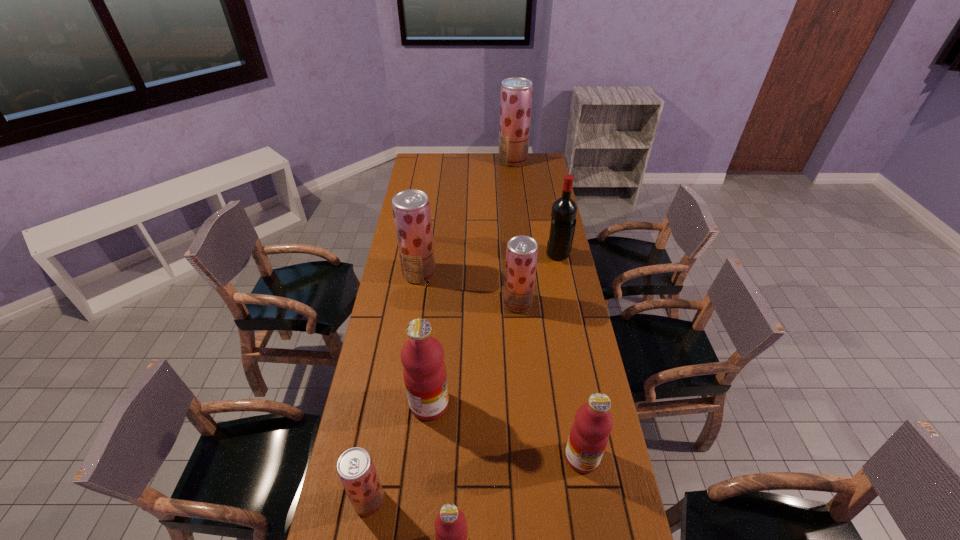
This screenshot has height=540, width=960. Identify the location of the farthest object. (516, 92).

Where is `the tallest fruit juice`? the tallest fruit juice is located at coordinates (516, 92).

In order to click on wine bottle in this screenshot , I will do `click(563, 215)`.

At what (x,y) coordinates should I click in order to perform the action: click on the second biggest strawberry fruit juice. Please return your answer as a coordinate pair (x, y). Looking at the image, I should click on (411, 208).

Find the location of a particular element. This screenshot has height=540, width=960. the second farthest fruit juice is located at coordinates (411, 208).

Locate an element on the screen. the biggest pink fruit juice is located at coordinates (422, 356).

Where is `the fourth farthest fruit juice`? the fourth farthest fruit juice is located at coordinates (422, 356).

The width and height of the screenshot is (960, 540). I want to click on the third farthest strawberry fruit juice, so click(x=522, y=251).

The image size is (960, 540). Identify the location of the third biggest strawberry fruit juice. (522, 251).

At what (x,y) coordinates should I click in order to perform the action: click on the second farthest pink fruit juice. Please return your answer as a coordinate pair (x, y). Looking at the image, I should click on (589, 435).